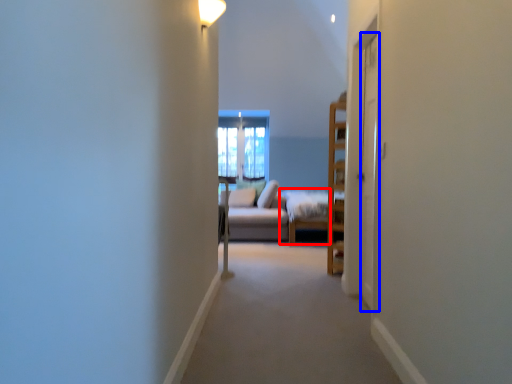
Question: Which point is further to the camera, bed frame (highlighted by a red box) or screen door (highlighted by a blue box)?

Choices:
 (A) bed frame
 (B) screen door

Answer: (A)